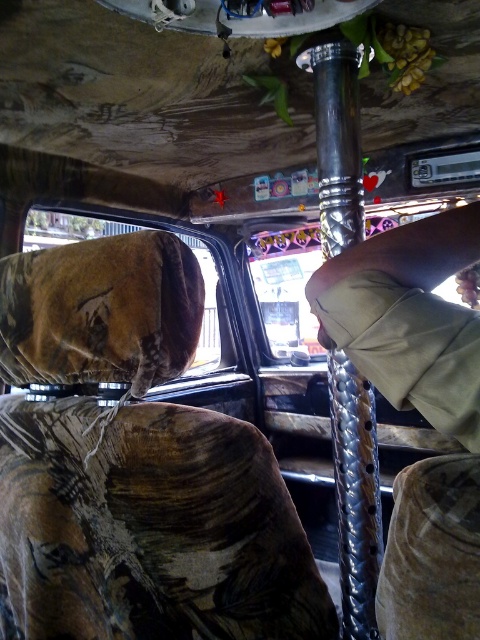
Who is taller, polished metal pole at center or transparent plastic window at center?

polished metal pole at center

Is point (343, 61) more distant than point (434, 234)?

Yes.

Where is `polished metal pole at center`? The image size is (480, 640). polished metal pole at center is located at coordinates (356, 496).

Which is above, polished metal pole at center or camouflage fabric car window at upper left?

camouflage fabric car window at upper left

The width and height of the screenshot is (480, 640). Describe the element at coordinates (356, 496) in the screenshot. I see `polished metal pole at center` at that location.

Identify the location of polished metal pole at center. (356, 496).

Is transparent plastic window at center further to camera compared to camouflage fabric car window at upper left?

No, it is not.

Which is behind, point (444, 262) or point (35, 236)?

The point (35, 236) is more distant.

Does point (420, 252) lie in front of point (194, 358)?

Yes, point (420, 252) is closer to viewer.

Find the location of a particular element. The height and width of the screenshot is (640, 480). transparent plastic window at center is located at coordinates (408, 252).